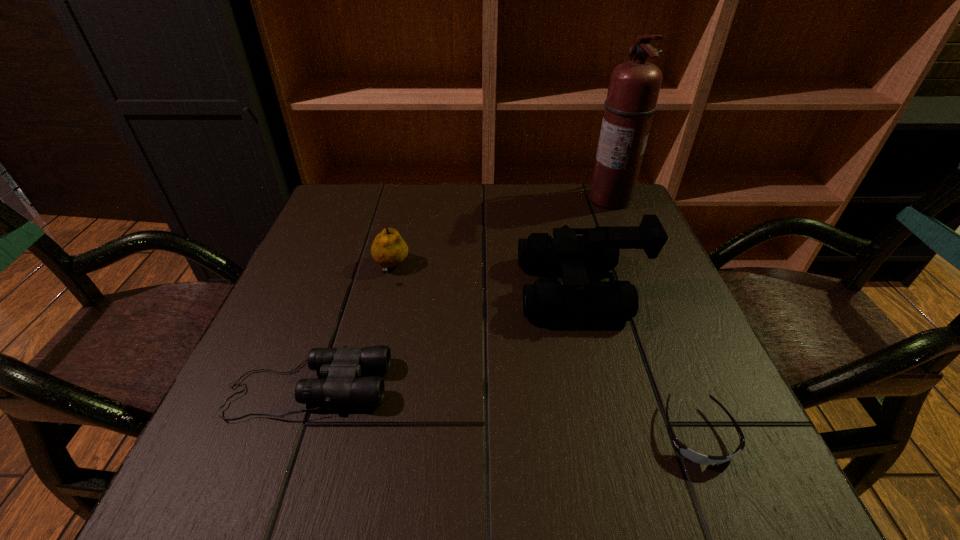
I want to click on binoculars that is at the right edge, so click(x=547, y=300).

Where is `sunglasses located in the right edge section of the desktop`? This screenshot has height=540, width=960. sunglasses located in the right edge section of the desktop is located at coordinates (682, 449).

Identify the location of object that is at the far right corner. (634, 86).

Image resolution: width=960 pixels, height=540 pixels. In order to click on object at the near right corner in this screenshot , I will do `click(682, 449)`.

Where is `free region at the far edge`? free region at the far edge is located at coordinates (408, 233).

Find the location of a particular element. The height and width of the screenshot is (540, 960). free point at the near edge is located at coordinates (575, 477).

Find the location of a particular element. free location at the left edge is located at coordinates (321, 258).

In the image, there is a desktop. Where is `vacant region at the right edge`? vacant region at the right edge is located at coordinates (676, 299).

In the image, there is a desktop. At what (x,y) coordinates should I click in order to perform the action: click on vacant space at the far left corner. Please return your answer as a coordinate pair (x, y). Image resolution: width=960 pixels, height=540 pixels. Looking at the image, I should click on coord(372,187).

Where is `vacant space at the far right corner of the desktop`? The height and width of the screenshot is (540, 960). vacant space at the far right corner of the desktop is located at coordinates (635, 207).